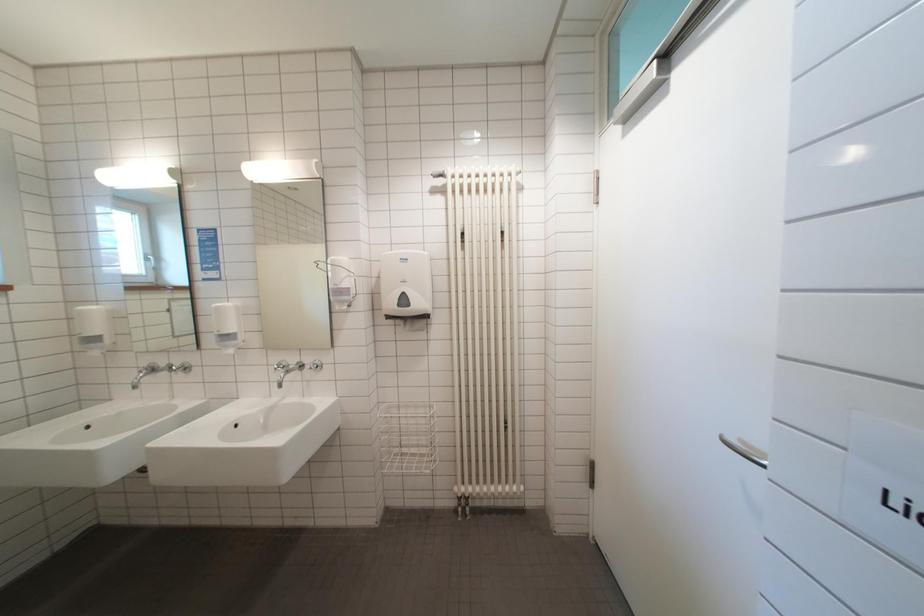
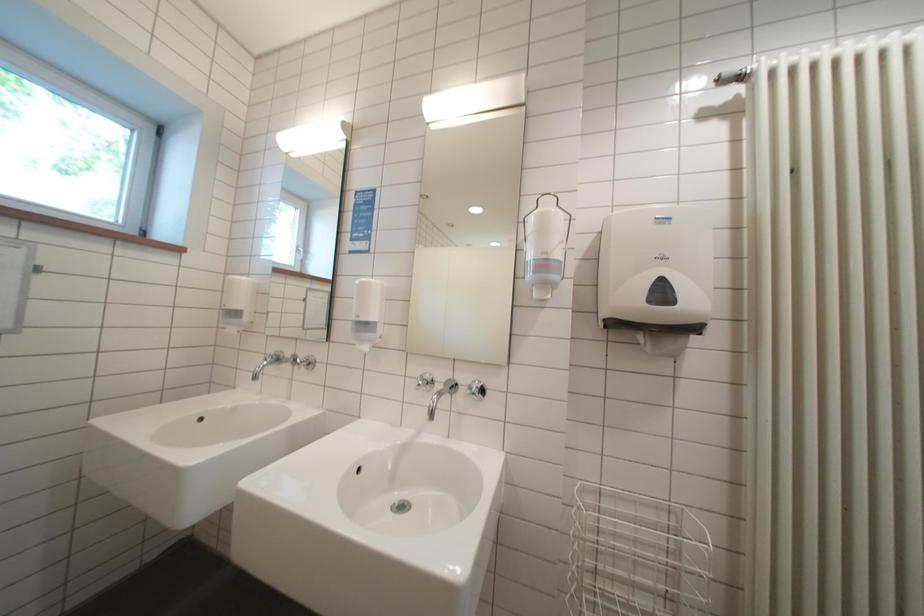
The images are taken continuously from a first-person perspective. In which direction are you moving?

The cameraman walked toward left, forward.